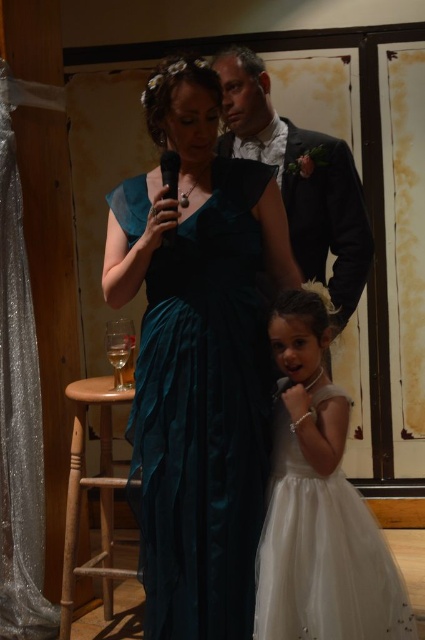
Describe the element at coordinates (319, 504) in the screenshot. I see `white satin dress at center` at that location.

Between white satin dress at center and wooden stool at lower left, which one is positioned lower?

Positioned lower is wooden stool at lower left.

Does point (265, 576) lie behind point (78, 509)?

That is False.

At what (x,y) coordinates should I click in order to perform the action: click on white satin dress at center. Please return your answer as a coordinate pair (x, y). Image resolution: width=425 pixels, height=640 pixels. Looking at the image, I should click on (319, 504).

Does teal satin dress at center have a lesser height compared to shiny black suit at center?

Incorrect, teal satin dress at center's height does not fall short of shiny black suit at center's.

Does teal satin dress at center appear on the right side of shiny black suit at center?

In fact, teal satin dress at center is to the left of shiny black suit at center.

Image resolution: width=425 pixels, height=640 pixels. What are the coordinates of `teal satin dress at center` in the screenshot? It's located at (198, 358).

Find the location of a particular element. The image size is (425, 640). teal satin dress at center is located at coordinates (198, 358).

Does white satin dress at center lie in front of shiny black suit at center?

Yes, white satin dress at center is in front of shiny black suit at center.

Can you confirm if white satin dress at center is shorter than shiny black suit at center?

Yes, white satin dress at center is shorter than shiny black suit at center.

Image resolution: width=425 pixels, height=640 pixels. I want to click on white satin dress at center, so click(319, 504).